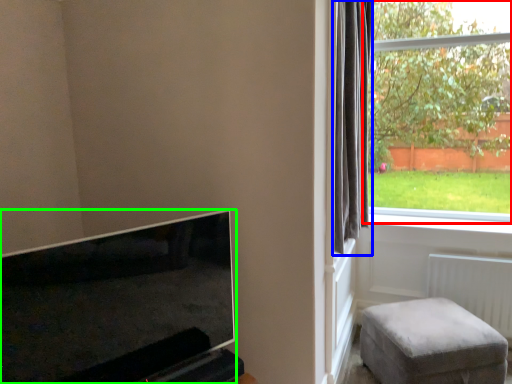
Question: Which is farther away from window (highlighted by a red box)? curtain (highlighted by a blue box) or television (highlighted by a green box)?

Choices:
 (A) curtain
 (B) television

Answer: (B)